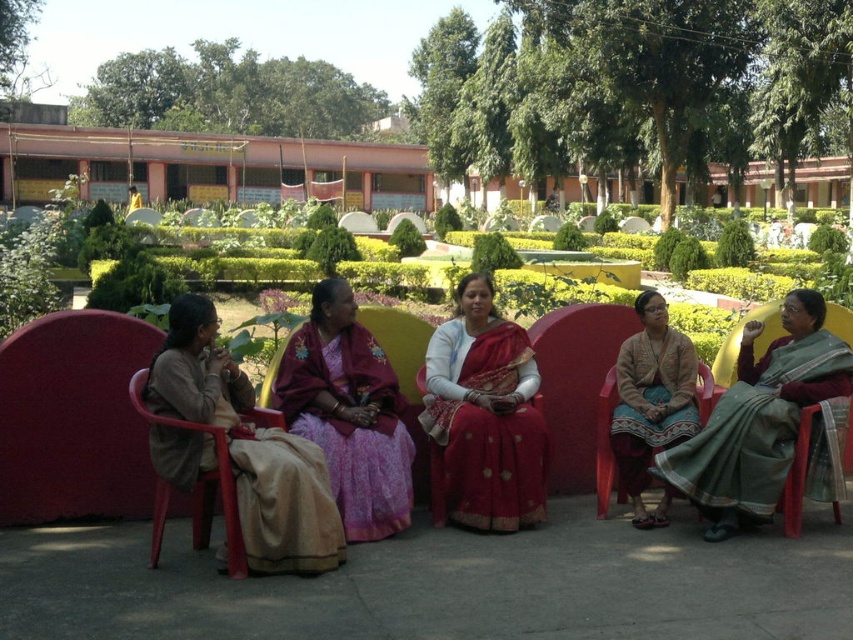
Question: Can you confirm if green grass at center is positioned below matte plastic chair at lower left?

Choices:
 (A) yes
 (B) no

Answer: (B)

Question: Which object is farther from the camera taking this photo?

Choices:
 (A) matte brown jacket at center
 (B) green silk saree at right
 (C) beige fabric saree at center

Answer: (A)

Question: Which of the following is the farthest from the observer?

Choices:
 (A) (672, 355)
 (B) (274, 419)
 (C) (732, 444)

Answer: (A)

Question: Which of the following is the closest to the observer?

Choices:
 (A) matte brown jacket at center
 (B) red silk saree at center
 (C) green silk saree at right
 (D) purple satin saree at center

Answer: (D)

Question: Is green silk saree at right wider than red silk saree at center?

Choices:
 (A) no
 (B) yes

Answer: (B)

Question: Can you confirm if red silk saree at center is positioned above matte brown jacket at center?

Choices:
 (A) yes
 (B) no

Answer: (A)